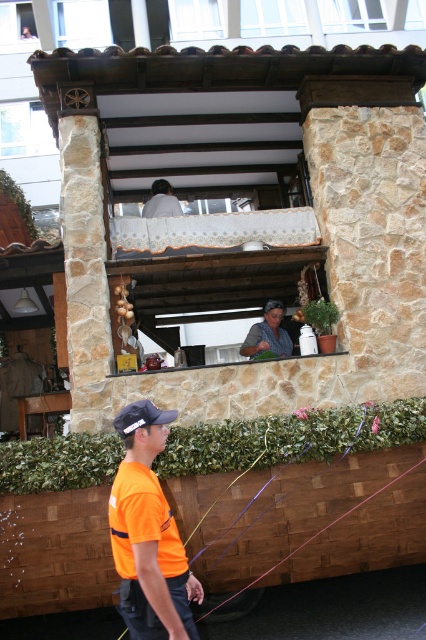
Which of these two, matte gray shirt at center or black fabric baseball cap at lower left, stands shorter?

black fabric baseball cap at lower left is shorter.

Is matte gray shirt at center wider than black fabric baseball cap at lower left?

Correct, the width of matte gray shirt at center exceeds that of black fabric baseball cap at lower left.

Between point (276, 312) and point (121, 432), which one is positioned in front?

Point (121, 432) is in front.

At what (x,y) coordinates should I click in order to perform the action: click on matte gray shirt at center. Please return your answer as a coordinate pair (x, y). The width and height of the screenshot is (426, 640). Looking at the image, I should click on (267, 333).

Is orange fabric shirt at lower left shorter than black fabric baseball cap at lower left?

Incorrect, orange fabric shirt at lower left's height does not fall short of black fabric baseball cap at lower left's.

Consider the image. Is orange fabric shirt at lower left wider than black fabric baseball cap at lower left?

Correct, the width of orange fabric shirt at lower left exceeds that of black fabric baseball cap at lower left.

Identify the location of orange fabric shirt at lower left. (149, 532).

Is point (170, 540) in front of point (250, 339)?

Yes, it is.

Does orange fabric shirt at lower left appear on the left side of matte gray shirt at center?

Correct, you'll find orange fabric shirt at lower left to the left of matte gray shirt at center.

Does point (160, 604) lie in front of point (255, 342)?

Yes, it is.

Where is `orange fabric shirt at lower left`? The height and width of the screenshot is (640, 426). orange fabric shirt at lower left is located at coordinates (149, 532).